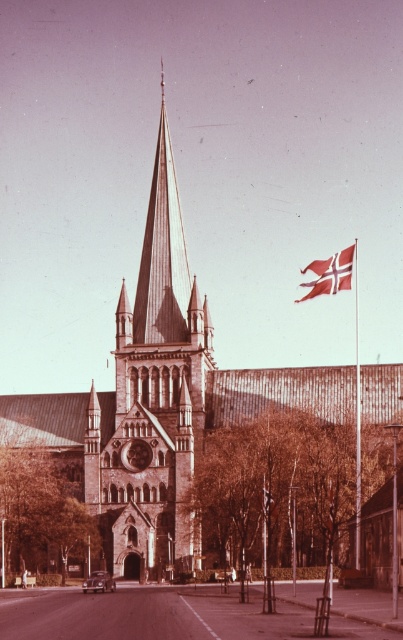
Is brown stone tower at center above metallic flagpole at right?

Yes.

Is point (172, 435) behind point (357, 321)?

That is False.

Find the location of a particular element. This screenshot has height=640, width=403. brown stone tower at center is located at coordinates (153, 401).

Is brown stone tower at center further to camera compared to white fabric flag at upper right?

No, brown stone tower at center is in front of white fabric flag at upper right.

Does point (151, 556) come farther from viewer compared to point (353, 253)?

No, it is not.

Image resolution: width=403 pixels, height=640 pixels. In order to click on brown stone tower at center in this screenshot , I will do `click(153, 401)`.

Does point (334, 289) come in front of point (353, 275)?

Yes, point (334, 289) is closer to viewer.

Where is `white fabric flag at upper right`? This screenshot has width=403, height=640. white fabric flag at upper right is located at coordinates (330, 273).